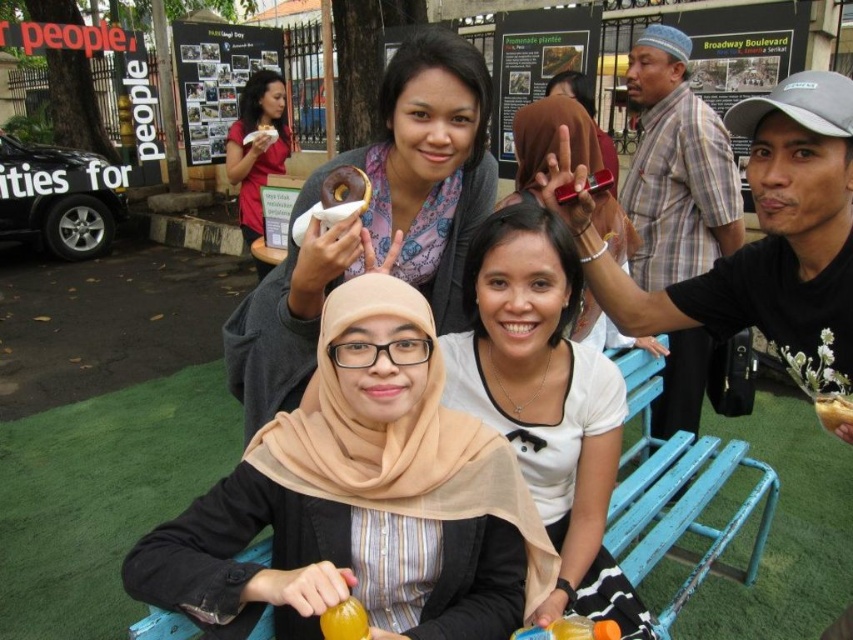
Can you confirm if matte beige hijab at center is positioned below matte brown donut at upper center?

Yes.

Is matte beige hijab at center to the right of matte brown donut at upper center from the viewer's perspective?

Yes, matte beige hijab at center is to the right of matte brown donut at upper center.

Who is more forward, (x=415, y=458) or (x=355, y=269)?

Point (x=415, y=458) is in front.

This screenshot has height=640, width=853. I want to click on matte beige hijab at center, so click(x=360, y=500).

Which is more to the right, matte brown donut at upper center or white matte shirt at center?

white matte shirt at center

Between point (421, 291) and point (614, 589), which one is positioned in front?

Point (614, 589) is more forward.

This screenshot has width=853, height=640. Find the location of `matte brown donut at upper center`. matte brown donut at upper center is located at coordinates (376, 220).

Does point (537, 109) come closer to viewer compared to point (242, 92)?

That is True.

How far apart are matte black phone at center and matte pink donut at upper left?

The distance of matte black phone at center from matte pink donut at upper left is 3.25 meters.

Who is more distant from viewer, (579,124) or (247,97)?

Point (247,97)

The height and width of the screenshot is (640, 853). In order to click on matte black phone at center in this screenshot , I will do `click(550, 140)`.